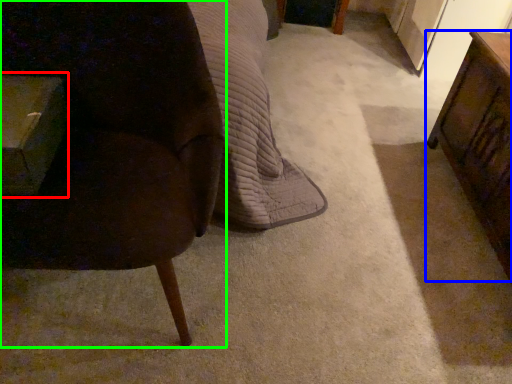
Question: Based on their relative distances, which object is farther from table (highlighted by a red box)? Choose from table (highlighted by a blue box) and chair (highlighted by a green box).

Choices:
 (A) table
 (B) chair

Answer: (A)